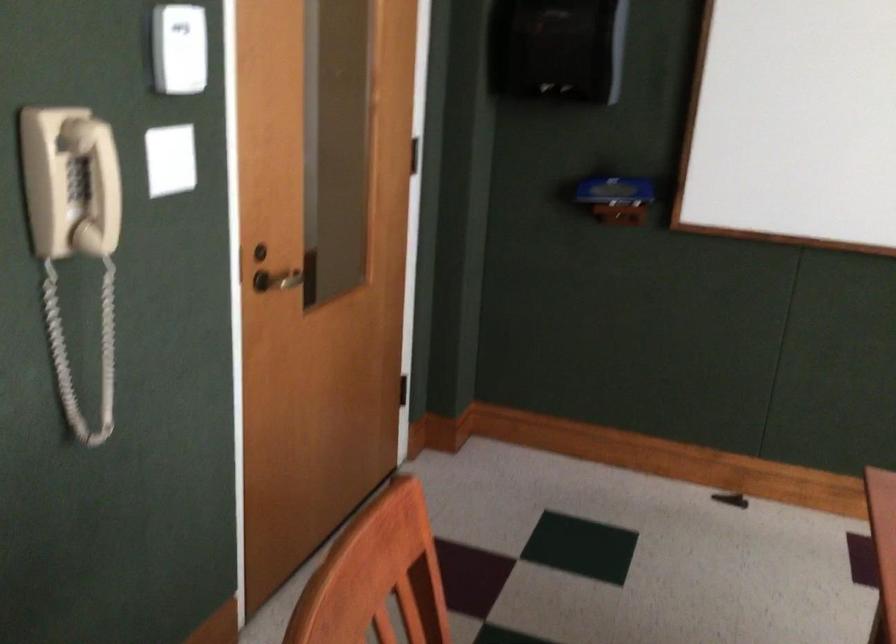
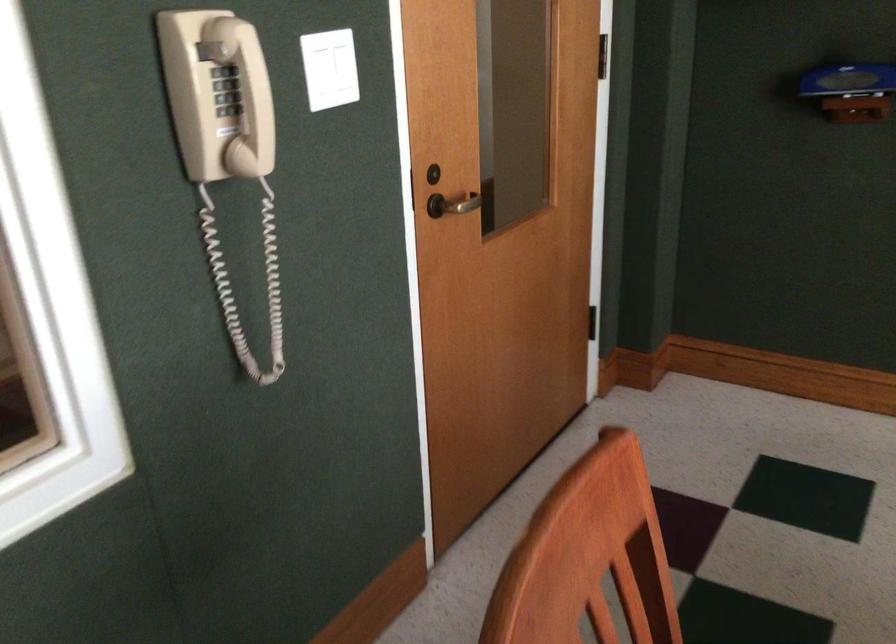
Where in the second image is the point corresponding to (x=288, y=288) from the first image?

(458, 204)